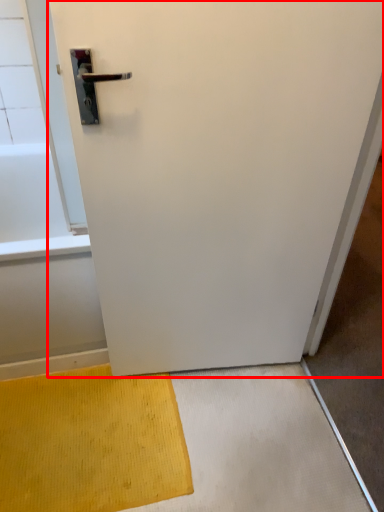
Question: In this image, where is door (annotated by the red box) located relative to doormat?

Choices:
 (A) right
 (B) left

Answer: (A)